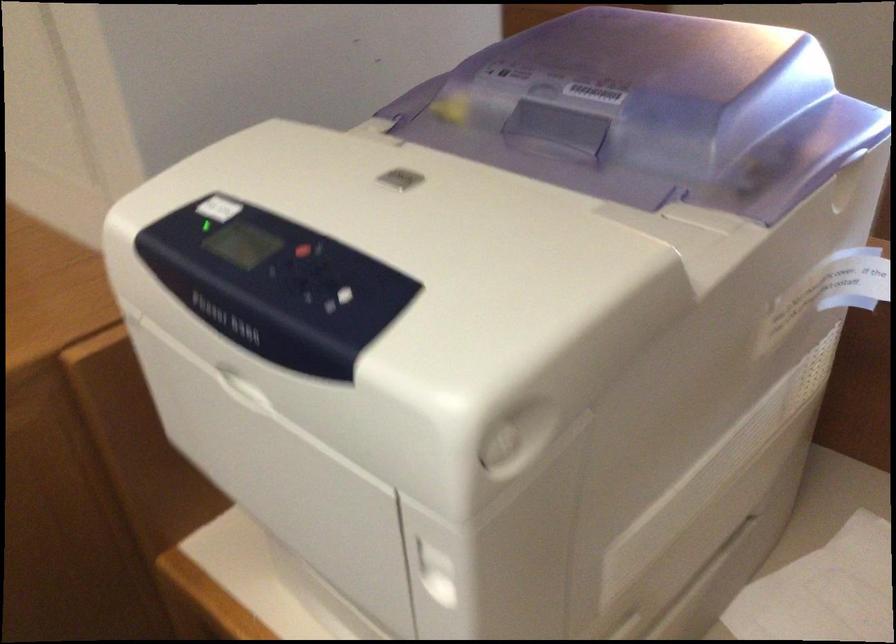
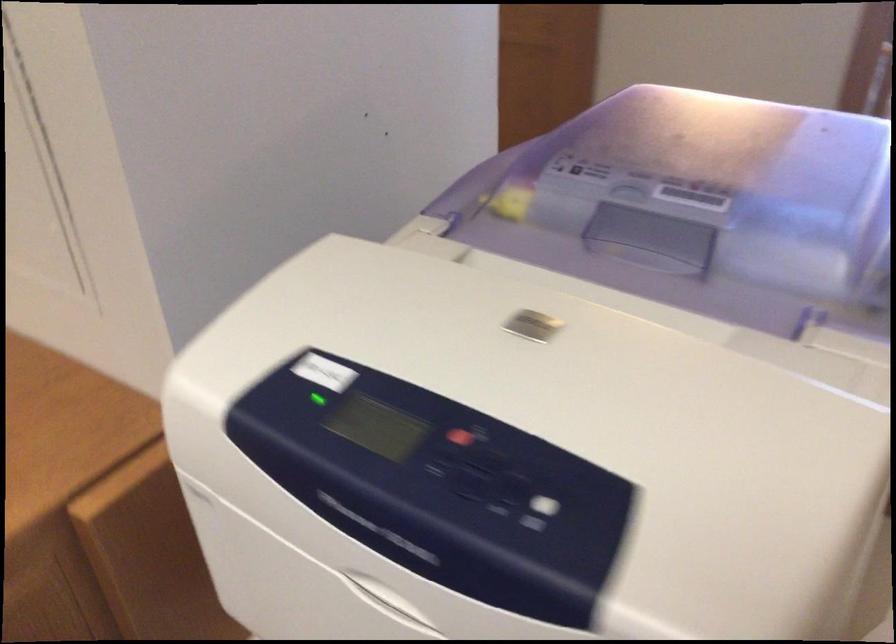
The point at (x=346, y=315) is marked in the first image. Where is the corresponding point in the second image?

(538, 512)